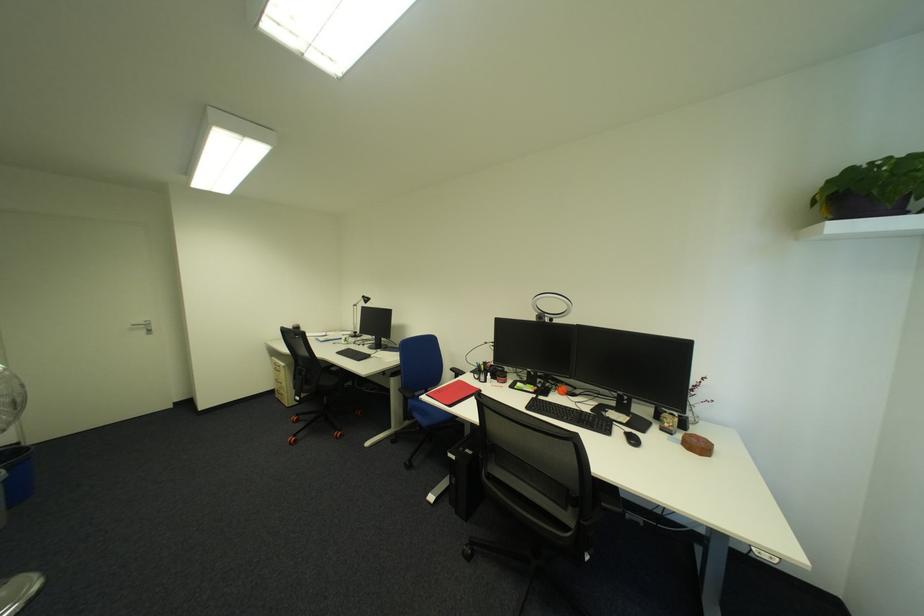
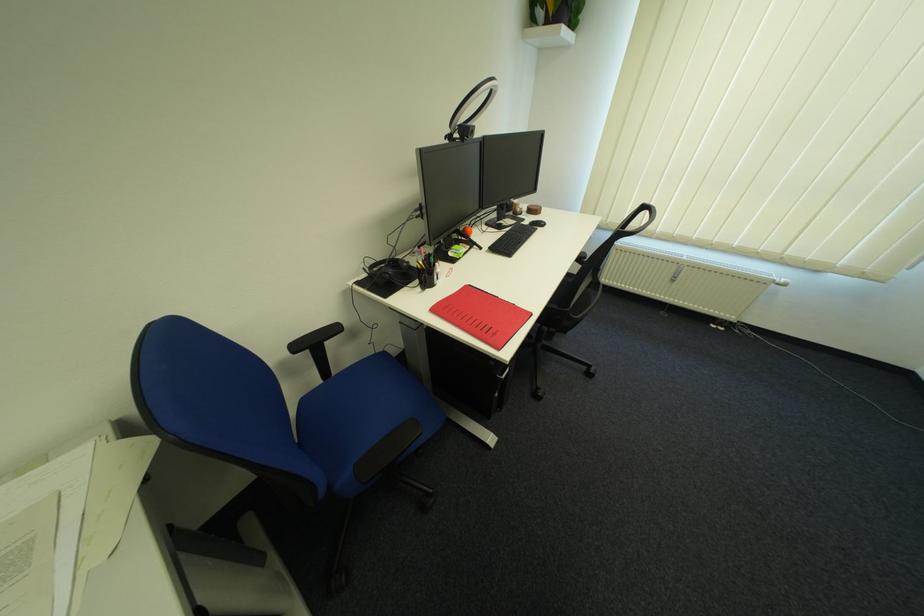
Where in the second image is the point corresponding to point (542, 392) from the first image?

(479, 248)